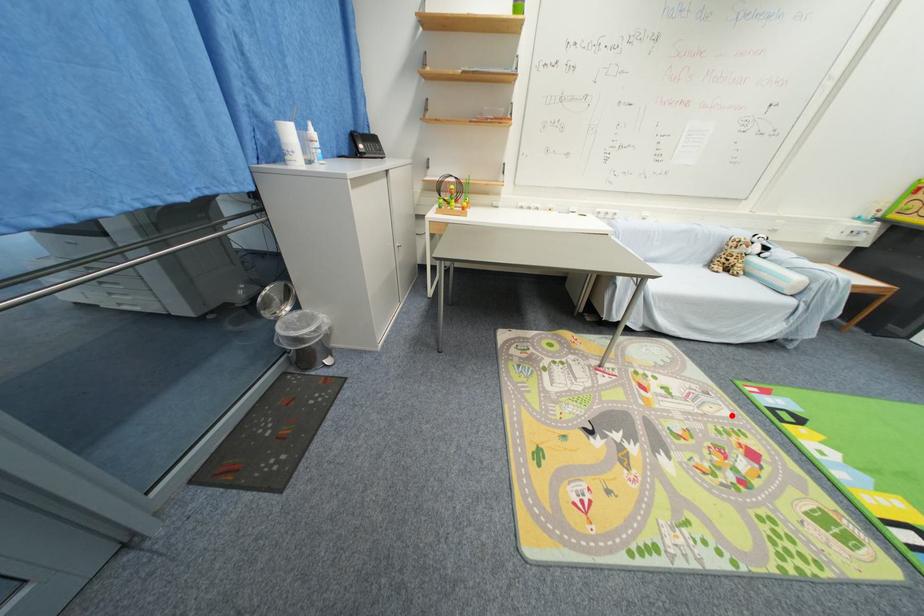
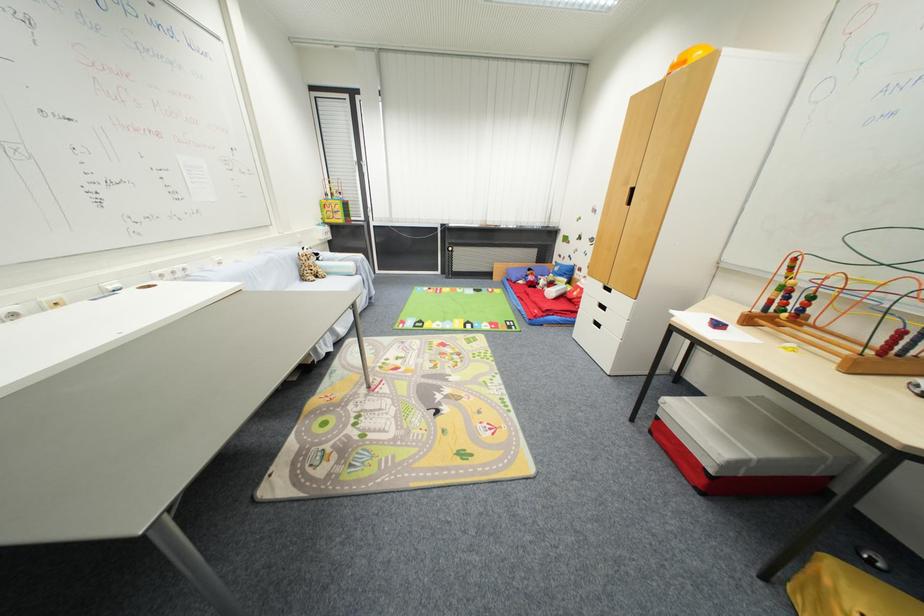
Locate, in the second image, the point that corresponds to the highlighted location in the first image.

(423, 342)